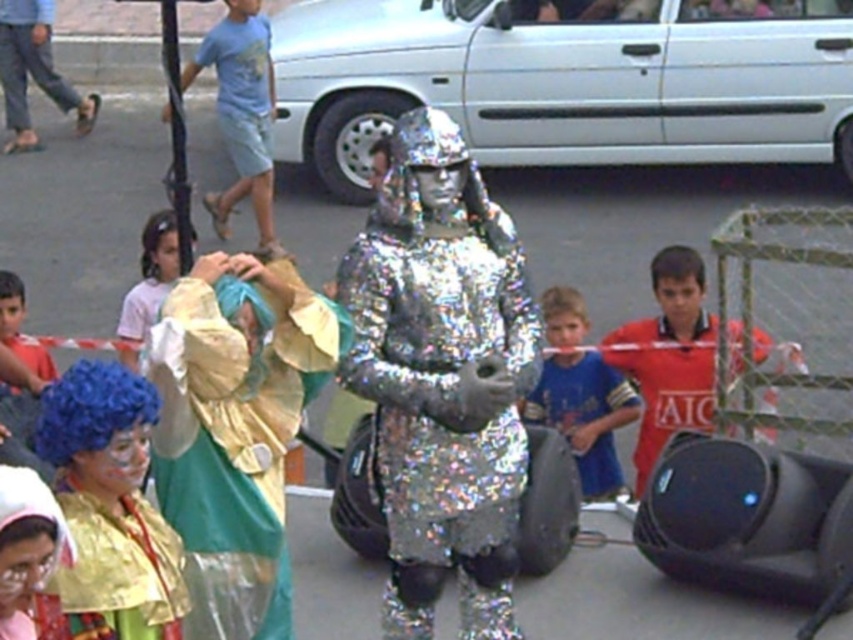
Is gold shiny fabric at center thinner than light blue denim shorts at upper left?

Yes.

Is gold shiny fabric at center taller than light blue denim shorts at upper left?

No.

Describe the element at coordinates (235, 429) in the screenshot. I see `gold shiny fabric at center` at that location.

At what (x,y) coordinates should I click in order to perform the action: click on gold shiny fabric at center. Please return your answer as a coordinate pair (x, y). This screenshot has width=853, height=640. Looking at the image, I should click on (235, 429).

Between gold sequined costume at lower left and light blue denim shorts at upper left, which one is positioned higher?

Positioned higher is light blue denim shorts at upper left.

Between point (148, 513) and point (265, 173), which one is positioned in front?

Positioned in front is point (148, 513).

Identify the location of gold sequined costume at lower left. The width and height of the screenshot is (853, 640). (114, 572).

Is holographic foil suit at center bigger than shiny gold costume at lower left?

Yes.

Measure the distance between holographic foil suit at center and camera.

holographic foil suit at center is 20.82 feet away from camera.

Locate an element on the screen. This screenshot has width=853, height=640. holographic foil suit at center is located at coordinates (442, 378).